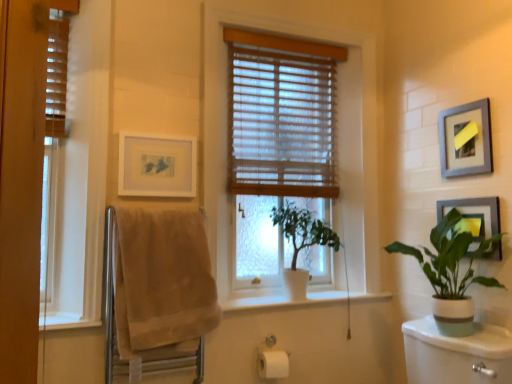
Question: Could metallic silver picture frame at upper right, marked as the 2th picture frame in a left-to-right arrangement, be considered to be inside white matte picture frame at upper left, which ranks as the 3th picture frame in right-to-left order?

Choices:
 (A) yes
 (B) no

Answer: (B)

Question: From a real-world perspective, is white matte picture frame at upper left, which ranks as the 3th picture frame in right-to-left order, located higher than metallic silver picture frame at upper right, marked as the 2th picture frame in a left-to-right arrangement?

Choices:
 (A) yes
 (B) no

Answer: (B)

Question: From the image's perspective, would you say white matte picture frame at upper left, acting as the first picture frame starting from the left, is positioned over metallic silver picture frame at upper right, marked as the 2th picture frame in a left-to-right arrangement?

Choices:
 (A) yes
 (B) no

Answer: (B)

Question: Does white matte picture frame at upper left, which ranks as the 3th picture frame in right-to-left order, have a greater height compared to metallic silver picture frame at upper right, the 2th picture frame from the right?

Choices:
 (A) no
 (B) yes

Answer: (A)

Question: Is white matte picture frame at upper left, which ranks as the 3th picture frame in right-to-left order, in contact with metallic silver picture frame at upper right, marked as the 2th picture frame in a left-to-right arrangement?

Choices:
 (A) yes
 (B) no

Answer: (B)

Question: Is white matte plant at center, the 2th houseplant viewed from the right, in front of or behind wooden blinds at center, the second window when ordered from front to back, in the image?

Choices:
 (A) behind
 (B) front

Answer: (A)

Question: From a real-world perspective, is white matte plant at center, the 2th houseplant viewed from the right, physically located above or below wooden blinds at center, which is the 1th window from back to front?

Choices:
 (A) above
 (B) below

Answer: (B)

Question: Is white matte plant at center, the 2th houseplant viewed from the right, taller or shorter than wooden blinds at center, the second window when ordered from front to back?

Choices:
 (A) short
 (B) tall

Answer: (A)

Question: Is white matte plant at center, the 2th houseplant viewed from the right, inside or outside of wooden blinds at center, which is the 1th window from back to front?

Choices:
 (A) outside
 (B) inside

Answer: (B)

Question: Is point (288, 276) closer or farther from the camera than point (73, 244)?

Choices:
 (A) closer
 (B) farther

Answer: (B)

Question: Based on their positions, is white matte plant at center, which is counted as the first houseplant, starting from the left, located to the left or right of wooden blinds at left, acting as the 2th window starting from the back?

Choices:
 (A) left
 (B) right

Answer: (B)

Question: Choose the correct answer: Is white matte plant at center, which is counted as the first houseplant, starting from the left, inside wooden blinds at left, acting as the 1th window starting from the left, or outside it?

Choices:
 (A) outside
 (B) inside

Answer: (A)

Question: From a real-world perspective, relative to wooden blinds at left, acting as the 1th window starting from the left, is white matte plant at center, which is counted as the first houseplant, starting from the left, vertically above or below?

Choices:
 (A) below
 (B) above

Answer: (A)

Question: Visually, is white matte plant at center, the 2th houseplant viewed from the right, positioned to the left or to the right of metallic silver picture frame at upper right, the 2th picture frame from the right?

Choices:
 (A) right
 (B) left

Answer: (B)

Question: Is white matte plant at center, the 2th houseplant viewed from the right, bigger or smaller than metallic silver picture frame at upper right, marked as the 2th picture frame in a left-to-right arrangement?

Choices:
 (A) big
 (B) small

Answer: (A)